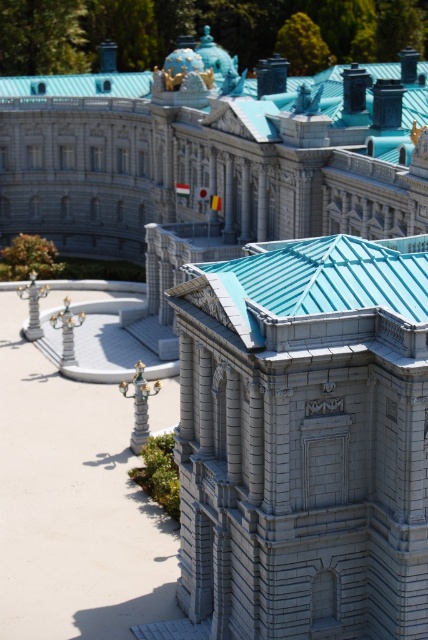
What do you see at coordinates (305, 440) in the screenshot?
I see `gray stone tower at center` at bounding box center [305, 440].

Who is positioned more to the left, gray stone tower at center or smooth white palace at center?

gray stone tower at center

The image size is (428, 640). Describe the element at coordinates (305, 440) in the screenshot. I see `gray stone tower at center` at that location.

In order to click on gray stone tower at center in this screenshot , I will do click(305, 440).